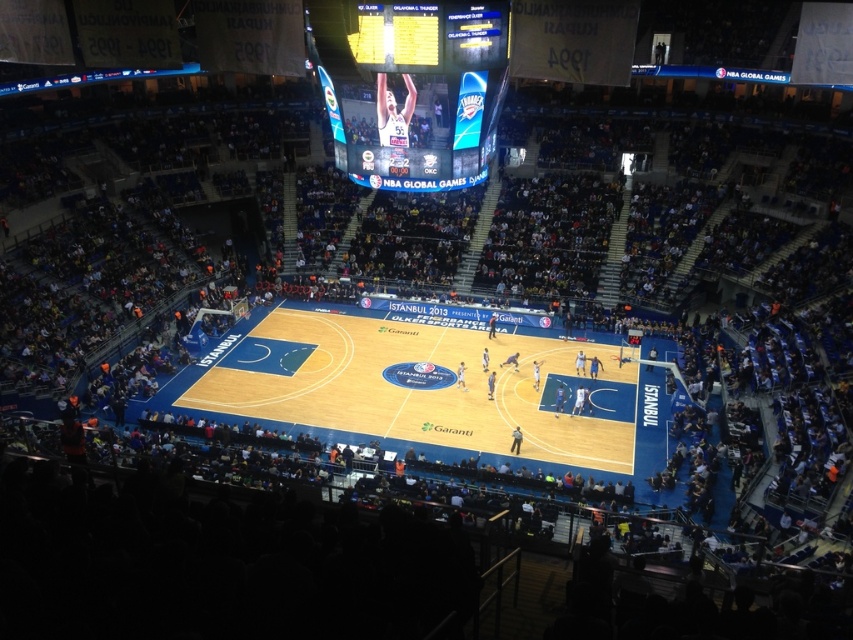
Question: Can you confirm if wooden at center is wider than matte plastic scoreboard at upper center?

Choices:
 (A) yes
 (B) no

Answer: (A)

Question: Which point is farther to the camera?

Choices:
 (A) (376, 51)
 (B) (426, 428)

Answer: (B)

Question: Which point appears closest to the camera in this image?

Choices:
 (A) (339, 93)
 (B) (482, 33)
 (C) (579, 460)

Answer: (B)

Question: Does wooden at center have a greater width compared to shiny digital display at center?

Choices:
 (A) no
 (B) yes

Answer: (B)

Question: Which of the following is the farthest from the observer?

Choices:
 (A) (618, 417)
 (B) (386, 44)
 (C) (430, 13)

Answer: (A)

Question: Does wooden at center have a smaller size compared to shiny digital display at center?

Choices:
 (A) yes
 (B) no

Answer: (B)